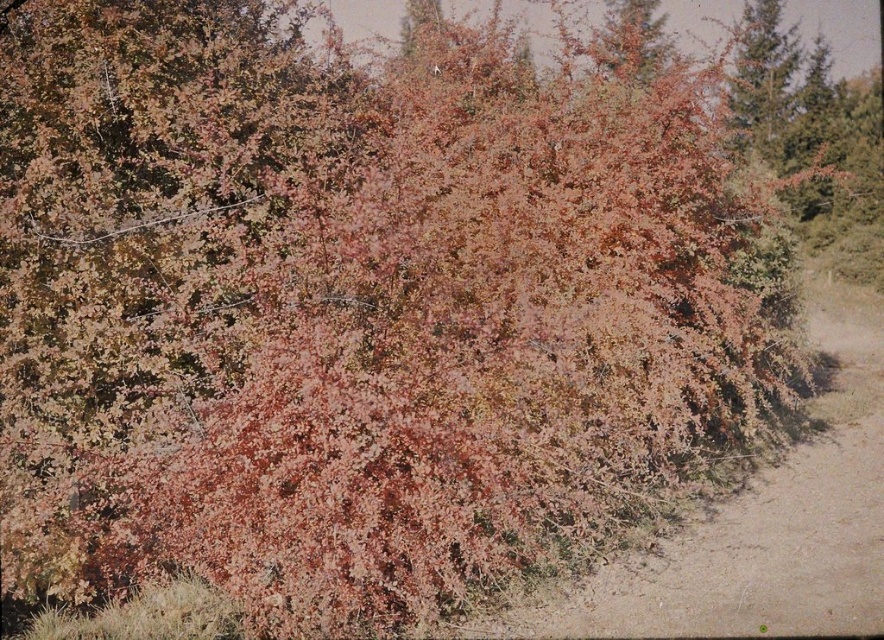
You are a hiker who wants to follow the brown sandy dirt track at lower right but also notices the leaves at upper right. Which object is nearer to you as you stand at the starting point?

The brown sandy dirt track at lower right is closer to the viewer than the leaves at upper right, so the brown sandy dirt track at lower right is nearer to you.